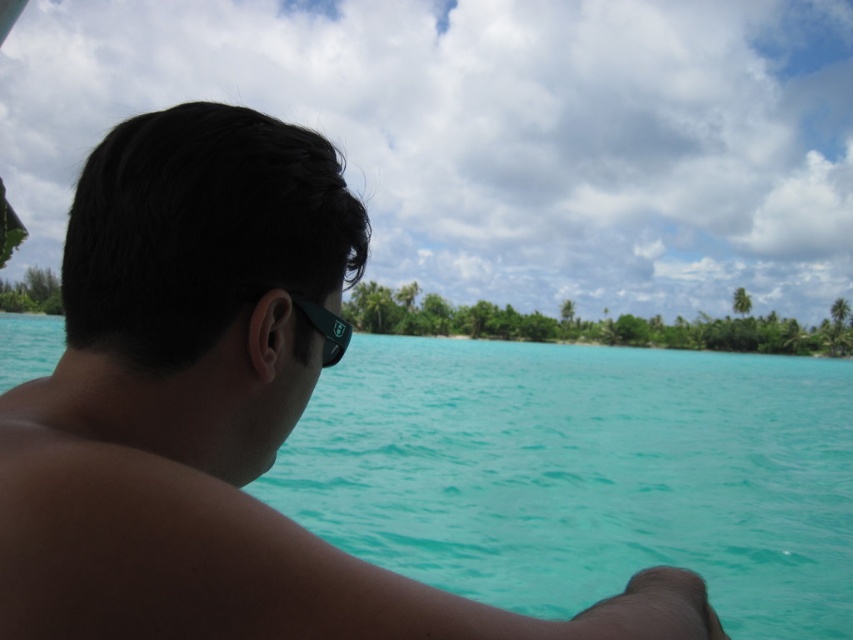
Question: Where is matte black sunglasses at upper left located in relation to black rubber goggles at ear in the image?

Choices:
 (A) left
 (B) right

Answer: (B)

Question: Is matte black sunglasses at upper left thinner than black rubber goggles at ear?

Choices:
 (A) yes
 (B) no

Answer: (B)

Question: Is matte black sunglasses at upper left further to the viewer compared to black rubber goggles at ear?

Choices:
 (A) no
 (B) yes

Answer: (A)

Question: Which of the following is the closest to the observer?

Choices:
 (A) matte black sunglasses at upper left
 (B) black rubber goggles at ear

Answer: (A)

Question: Which of the following is the closest to the observer?

Choices:
 (A) black rubber goggles at ear
 (B) matte black sunglasses at upper left

Answer: (B)